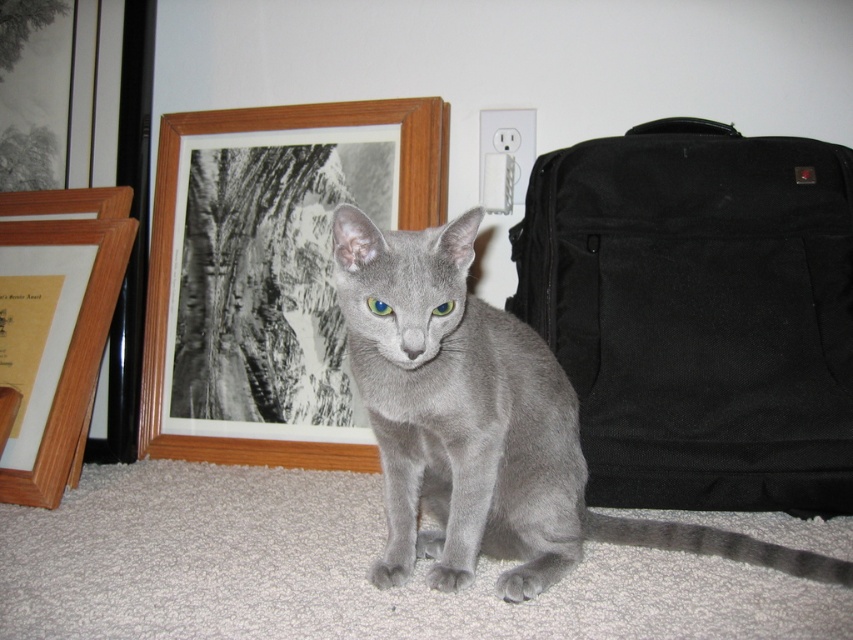
Question: Can you confirm if black canvas suitcase at right is bigger than blue glossy eye at center?

Choices:
 (A) yes
 (B) no

Answer: (A)

Question: Is gray matte fur cat at center smaller than wooden picture frame at left?

Choices:
 (A) no
 (B) yes

Answer: (A)

Question: Which object is closer to the camera taking this photo?

Choices:
 (A) wooden picture frame at left
 (B) black canvas suitcase at right

Answer: (B)

Question: Which object appears closest to the camera in this image?

Choices:
 (A) black canvas suitcase at right
 (B) gray matte fur cat at center
 (C) wooden picture frame at left
 (D) green matte eye at center

Answer: (B)

Question: Does wooden picture frame at upper center lie behind gray matte fur cat at center?

Choices:
 (A) no
 (B) yes

Answer: (B)

Question: Which point is closer to the camera?

Choices:
 (A) gray matte fur cat at center
 (B) black canvas suitcase at right

Answer: (A)